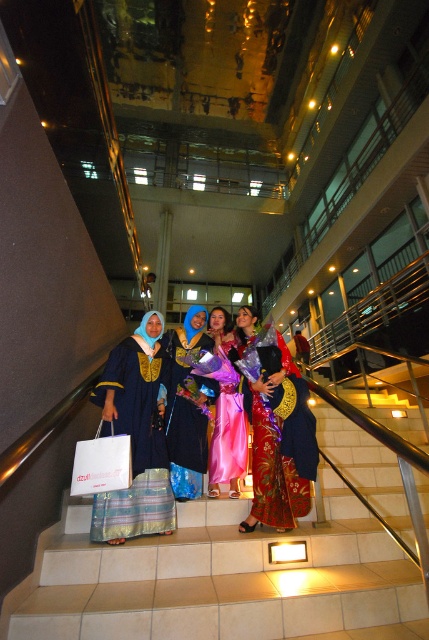
Question: Estimate the real-world distances between objects in this image. Which object is farther from the silky blue dress at center?

Choices:
 (A) white paper shopping bag at lower left
 (B) matte blue dress at center

Answer: (A)

Question: Is silk floral dress at center closer to camera compared to silky blue dress at center?

Choices:
 (A) yes
 (B) no

Answer: (A)

Question: Which of the following is the closest to the observer?

Choices:
 (A) silky satin dress at center
 (B) silk floral dress at center

Answer: (A)

Question: Is matte blue dress at center bigger than silky pink dress at center?

Choices:
 (A) no
 (B) yes

Answer: (B)

Question: Can you confirm if silky satin dress at center is positioned above silky blue dress at center?

Choices:
 (A) yes
 (B) no

Answer: (B)

Question: Which point appears farthest from the camera in this image?

Choices:
 (A) (126, 403)
 (B) (253, 444)
 (C) (311, 532)

Answer: (B)